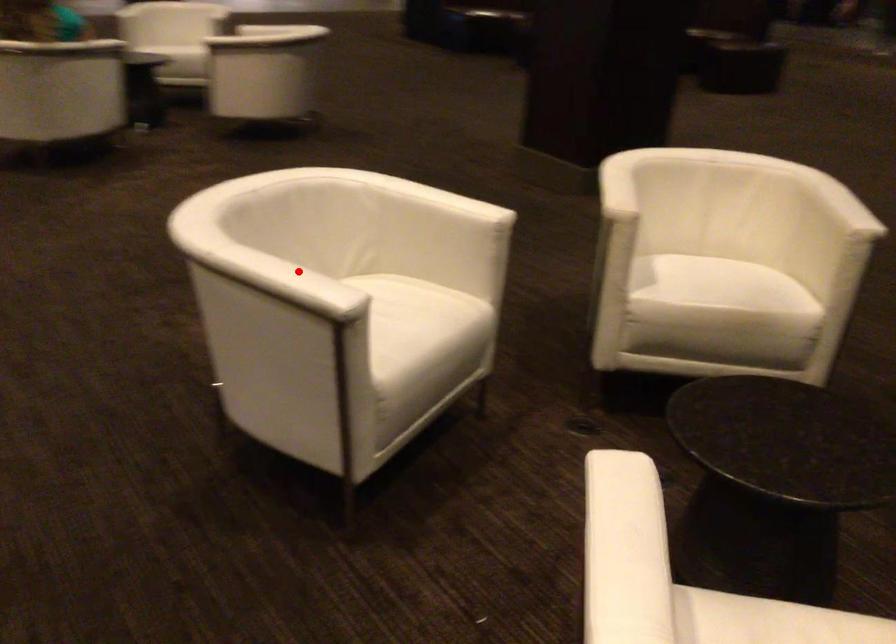
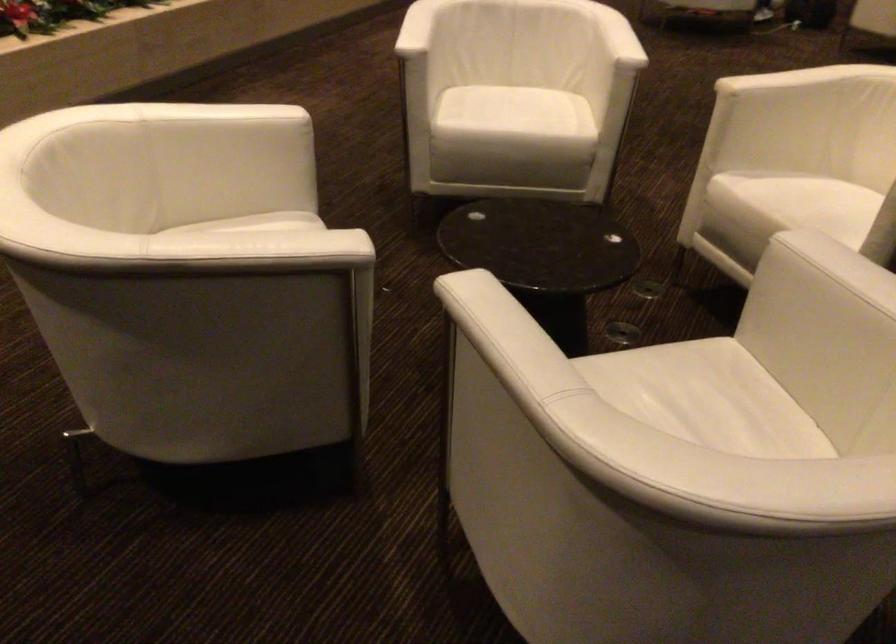
Question: A red point is marked in image1. In image2, is the corresponding 3D point closer to the camera or farther? Reply with the corresponding letter.

Choices:
 (A) The corresponding 3D point is closer.
 (B) The corresponding 3D point is farther.

Answer: (B)